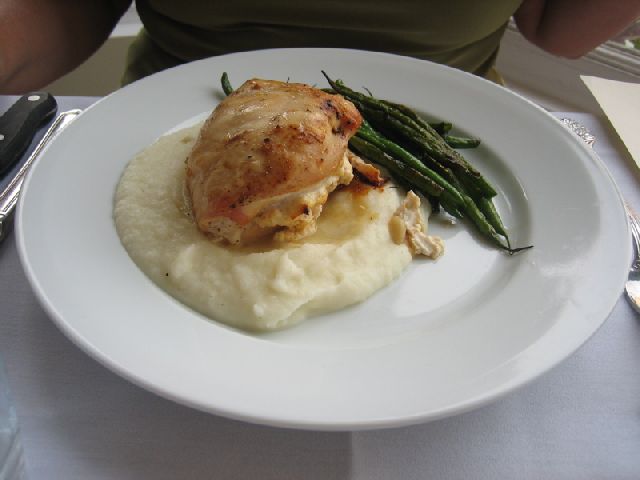
This screenshot has height=480, width=640. What are the coordinates of `plate` in the screenshot? It's located at (502, 361).